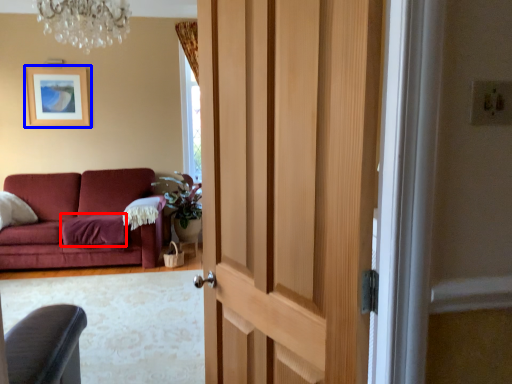
Question: Which object appears closest to the camera in this image, blanket (highlighted by a red box) or picture frame (highlighted by a blue box)?

Choices:
 (A) blanket
 (B) picture frame

Answer: (A)